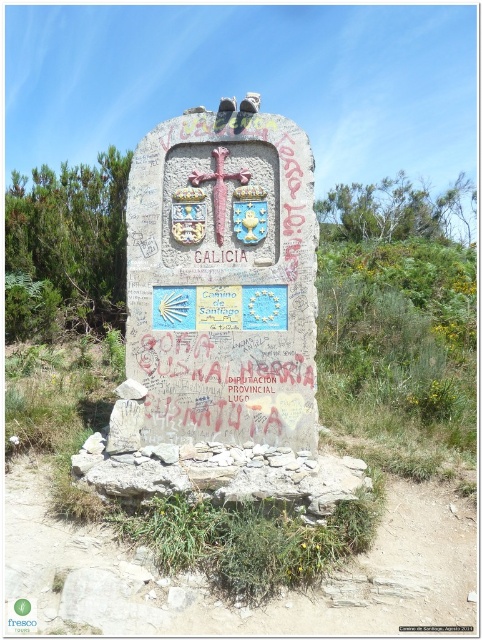
You are standing in front of the stone monument and want to touch the polished wood cross at center. Is the stone plaque at center blocking your direct path to it?

The stone plaque at center is in front of the polished wood cross at center, so it is blocking your direct path to the cross.

You are a hiker who has come across this monument. You notice the stone plaque at center and the polished wood cross at center. Which object is located higher up on the monument?

The polished wood cross at center is located higher up on the monument because the stone plaque at center is positioned under it.

You are an archaeologist examining the stone monument. You notice the stone plaque at center and the polished wood cross at center. Which object is wider?

The stone plaque at center is wider than the polished wood cross at center according to the description.